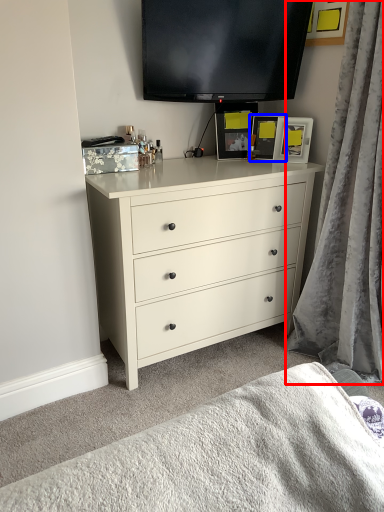
Question: Which point is further to the camera, curtain (highlighted by a red box) or picture frame (highlighted by a blue box)?

Choices:
 (A) curtain
 (B) picture frame

Answer: (B)